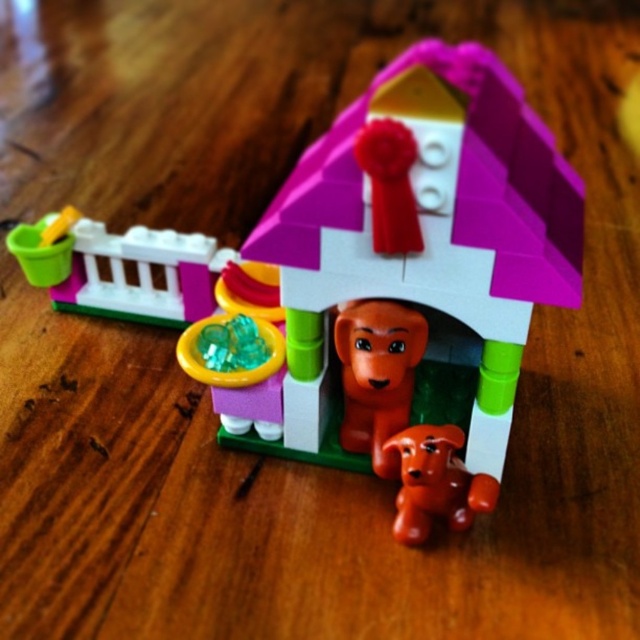
Question: From the image, what is the correct spatial relationship of smooth plastic bucket at left in relation to matte plastic dog at lower center?

Choices:
 (A) left
 (B) right

Answer: (A)

Question: Which object is the closest to the matte plastic dog at lower center?

Choices:
 (A) smooth plastic bucket at left
 (B) translucent green plastic bowl at center

Answer: (B)

Question: In this image, where is matte orange doll at center located relative to matte plastic dog at lower center?

Choices:
 (A) right
 (B) left

Answer: (B)

Question: Does smooth plastic bucket at left have a larger size compared to matte plastic dog at lower center?

Choices:
 (A) no
 (B) yes

Answer: (B)

Question: Which object is farther from the camera taking this photo?

Choices:
 (A) translucent green plastic bowl at center
 (B) matte orange doll at center
 (C) matte plastic dog at lower center
 (D) smooth plastic bucket at left

Answer: (D)

Question: Among these objects, which one is farthest from the camera?

Choices:
 (A) matte plastic dog at lower center
 (B) smooth plastic bucket at left
 (C) matte orange doll at center
 (D) translucent green plastic bowl at center

Answer: (B)